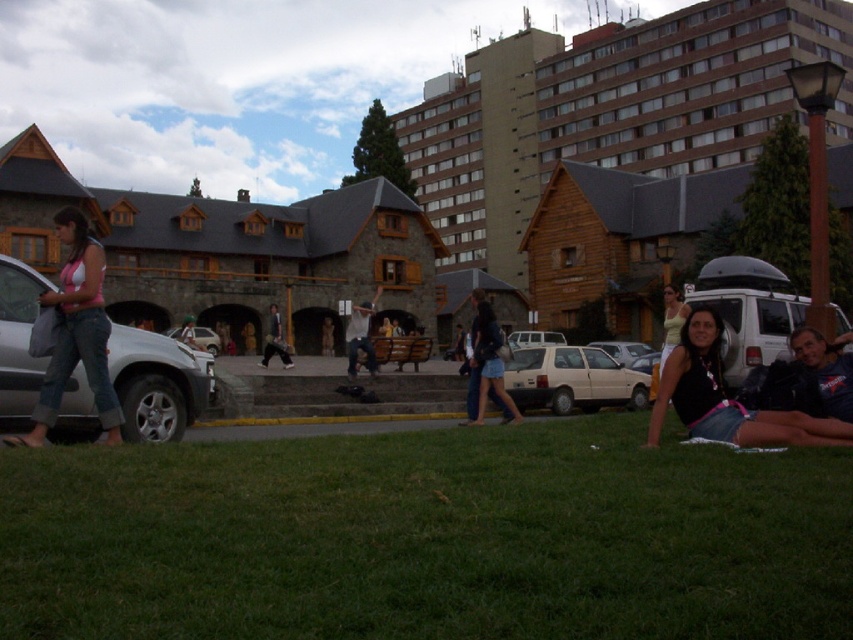
You are driving a beige matte hatchback at center and need to park it in a parking spot that can only accommodate vehicles narrower than the white cotton shirt at center. Can you park there?

The beige matte hatchback at center has a width less than the white cotton shirt at center, so yes, it can park in the spot since its width is narrower than the allowed limit.

Consider the image. You are planning to park your vehicle in a tight space between two other cars. You see a matte white car at center and a beige matte van at center. Which vehicle should you avoid choosing to park next to if you need more vertical clearance?

The beige matte van at center is taller than the matte white car at center, so you should avoid parking next to the beige matte van at center to ensure sufficient vertical clearance.

You are a photographer taking a picture of the town square. You want to ensure that both the black fabric bikini top at lower right and the beige matte hatchback at center are visible in the frame. Based on their positions, which object should you adjust your camera angle to focus on first to include both?

The black fabric bikini top at lower right is to the left of the beige matte hatchback at center, so you should focus on the beige matte hatchback at center first to ensure both objects are in the frame.